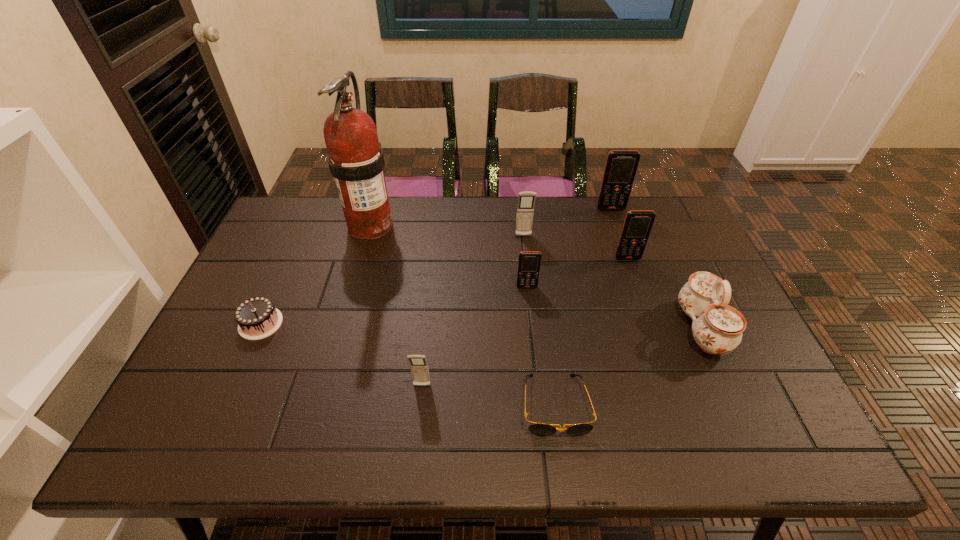
Where is `the second object from left to right`? the second object from left to right is located at coordinates (356, 161).

At what (x,y) coordinates should I click in order to perform the action: click on fire extinguisher. Please return your answer as a coordinate pair (x, y). This screenshot has height=540, width=960. Looking at the image, I should click on (356, 161).

Identify the location of the farthest cellular telephone. click(x=621, y=165).

Locate an element on the screen. Image resolution: width=960 pixels, height=540 pixels. the biggest orange cellular telephone is located at coordinates click(x=621, y=165).

You are a GUI agent. You are given a task and a screenshot of the screen. Output one action in this format:
    pyautogui.click(x=<x>, y=<y>)
    Task: Click on the right gray cellular telephone
    This screenshot has width=960, height=540.
    Given the screenshot: What is the action you would take?
    pyautogui.click(x=526, y=200)

Locate an element on the screen. Image resolution: width=960 pixels, height=540 pixels. the farther gray cellular telephone is located at coordinates (526, 200).

Image resolution: width=960 pixels, height=540 pixels. Identify the location of the second biggest orange cellular telephone. (637, 226).

This screenshot has height=540, width=960. I want to click on the sixth nearest object, so click(x=637, y=226).

Where is `white chinaware`? The image size is (960, 540). white chinaware is located at coordinates (717, 328).

Image resolution: width=960 pixels, height=540 pixels. Find the location of `chinaware`. chinaware is located at coordinates (717, 328).